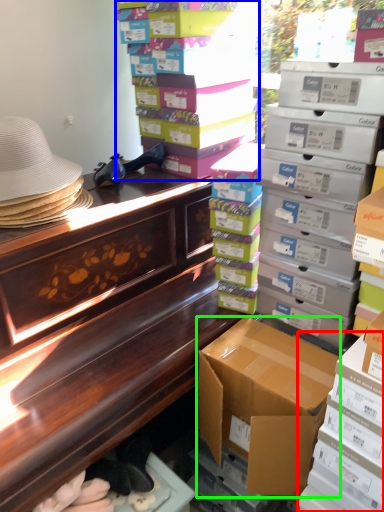
Question: Based on their relative distances, which object is farther from box (highlighted by a red box)? Choose from box (highlighted by a blue box) and box (highlighted by a green box).

Choices:
 (A) box
 (B) box

Answer: (A)